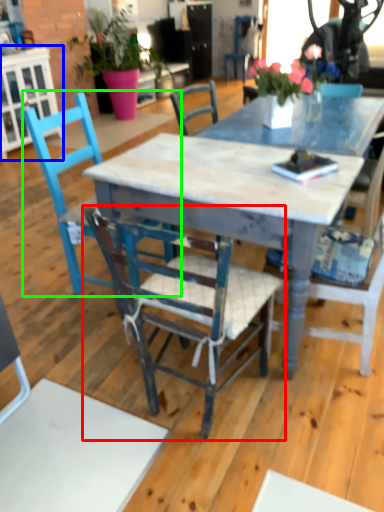
Question: Which object is the farthest from chair (highlighted by a red box)? Choose among these: cabinetry (highlighted by a blue box) or chair (highlighted by a green box).

Choices:
 (A) cabinetry
 (B) chair

Answer: (A)